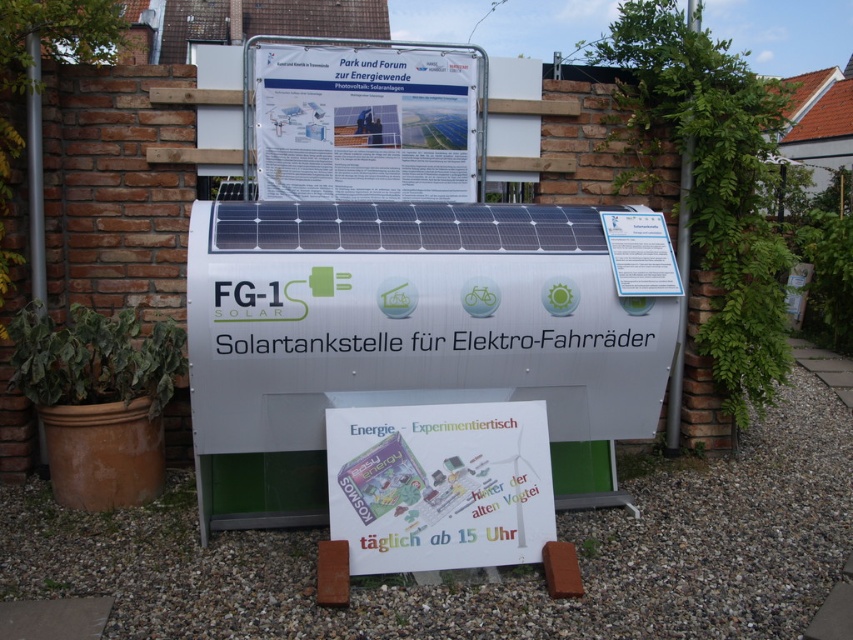
Question: Is green leafy plant at lower left thinner than green leafy plant at center?

Choices:
 (A) no
 (B) yes

Answer: (A)

Question: Is green leafy plant at lower left thinner than green leafy plant at center?

Choices:
 (A) yes
 (B) no

Answer: (B)

Question: Which object is positioned farthest from the green leafy plant at center?

Choices:
 (A) white paper at upper center
 (B) silver metallic solar battery at center
 (C) white paper sign at center
 (D) green leafy plant at right

Answer: (A)

Question: Which of these objects is positioned closest to the silver metallic solar battery at center?

Choices:
 (A) green leafy plant at center
 (B) green leafy plant at right
 (C) white paper at upper center
 (D) white paper sign at center

Answer: (D)

Question: Can you confirm if silver metallic solar battery at center is wider than white paper at upper center?

Choices:
 (A) yes
 (B) no

Answer: (A)

Question: Which point is farther from the camera taking this photo?

Choices:
 (A) (346, 301)
 (B) (368, 541)
 (C) (303, 74)
 (D) (180, 364)

Answer: (C)